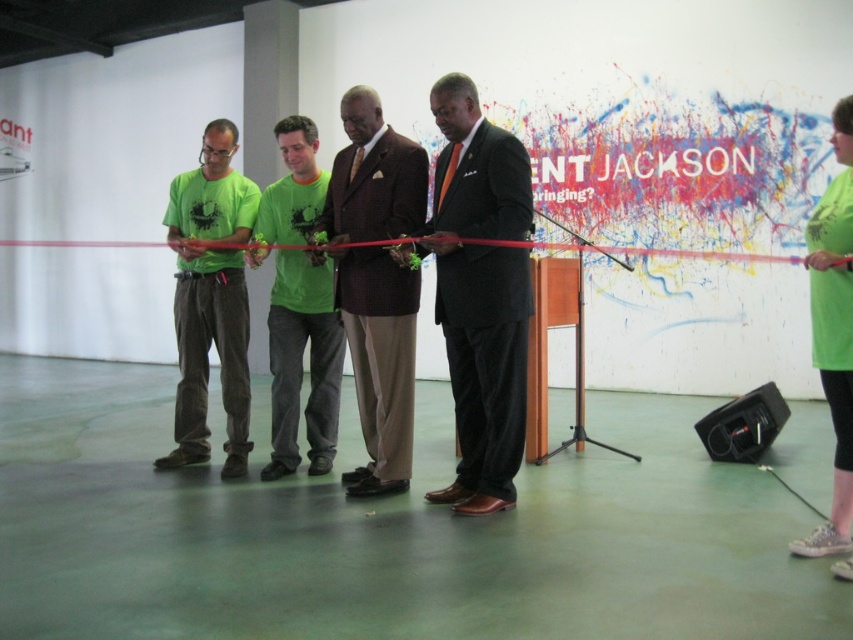
Question: Among these objects, which one is farthest from the camera?

Choices:
 (A) brown textured suit at center
 (B) black satin suit at center
 (C) green fabric shirt at right
 (D) green corduroy pants at left

Answer: (D)

Question: Is green corduroy pants at left to the right of green fabric shirt at right from the viewer's perspective?

Choices:
 (A) no
 (B) yes

Answer: (A)

Question: Based on their relative distances, which object is farther from the green fabric shirt at right?

Choices:
 (A) brown textured suit at center
 (B) green fabric shirt at center

Answer: (B)

Question: Which point is farther to the camera?

Choices:
 (A) brown textured suit at center
 (B) green fabric shirt at right

Answer: (A)

Question: Considering the relative positions of brown textured suit at center and green fabric shirt at right in the image provided, where is brown textured suit at center located with respect to green fabric shirt at right?

Choices:
 (A) right
 (B) left

Answer: (B)

Question: Considering the relative positions of black satin suit at center and green fabric shirt at center in the image provided, where is black satin suit at center located with respect to green fabric shirt at center?

Choices:
 (A) below
 (B) above

Answer: (A)